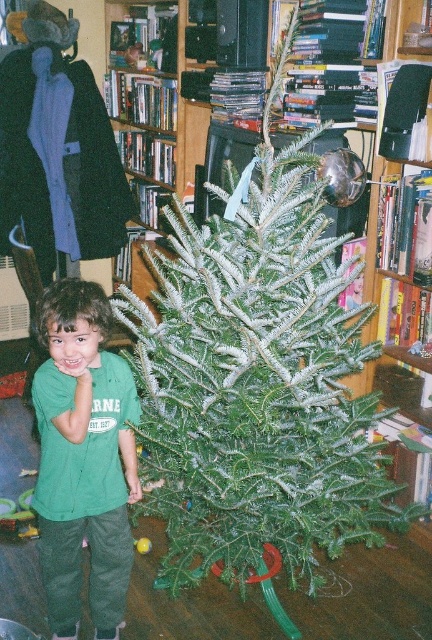
Question: Can you confirm if green textured christmas tree at center is positioned above green cotton shirt at center?

Choices:
 (A) yes
 (B) no

Answer: (A)

Question: Is green textured christmas tree at center below green cotton shirt at center?

Choices:
 (A) yes
 (B) no

Answer: (B)

Question: Which of the following is the closest to the observer?

Choices:
 (A) green textured christmas tree at center
 (B) green cotton shirt at center

Answer: (A)

Question: Which object appears farthest from the camera in this image?

Choices:
 (A) green textured christmas tree at center
 (B) green cotton shirt at center

Answer: (B)

Question: Which point is closer to the camera taking this photo?

Choices:
 (A) (308, 268)
 (B) (113, 483)

Answer: (A)

Question: Is green textured christmas tree at center wider than green cotton shirt at center?

Choices:
 (A) no
 (B) yes

Answer: (B)